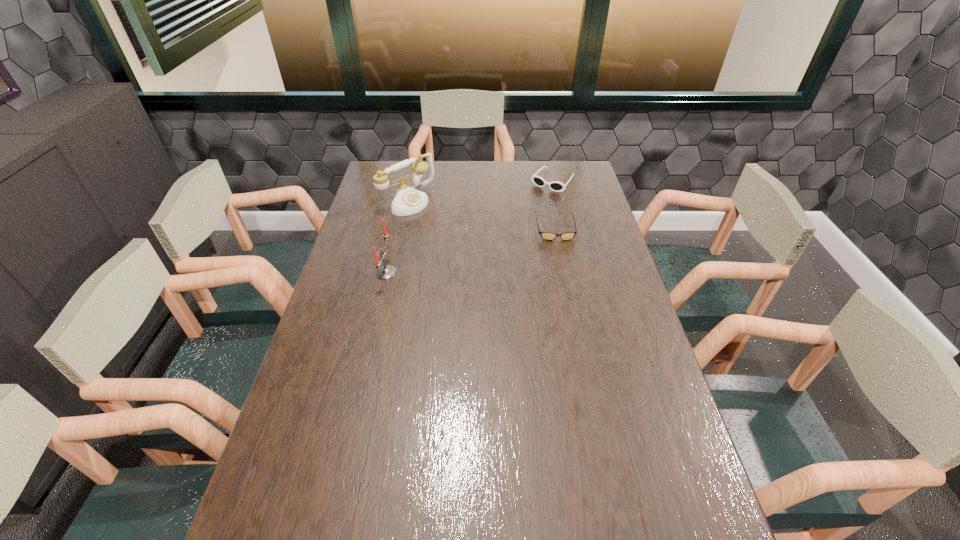
Locate an element on the screen. The width and height of the screenshot is (960, 540). candle is located at coordinates (387, 271).

I want to click on the shorter sunglasses, so click(550, 236).

You are a GUI agent. You are given a task and a screenshot of the screen. Output one action in this format:
    pyautogui.click(x=<x>, y=<y>)
    Task: Click on the shortest object
    This screenshot has width=960, height=540.
    Given the screenshot: What is the action you would take?
    pyautogui.click(x=550, y=236)

Locate an element on the screen. telephone is located at coordinates (407, 200).

Identify the location of the farther sunglasses. The image size is (960, 540). (556, 186).

Find the location of `the taller sunglasses`. the taller sunglasses is located at coordinates (556, 186).

Image resolution: width=960 pixels, height=540 pixels. Identify the location of blank area located on the front-facing side of the candle. (358, 273).

Where is `free spot located on the front-facing side of the candle`? The height and width of the screenshot is (540, 960). free spot located on the front-facing side of the candle is located at coordinates (343, 273).

Where is `free location located 0.100m on the front-facing side of the shorter sunglasses`? free location located 0.100m on the front-facing side of the shorter sunglasses is located at coordinates (562, 261).

Find the location of a particular element. The height and width of the screenshot is (540, 960). free space located 0.230m on the dial of the telephone is located at coordinates (465, 239).